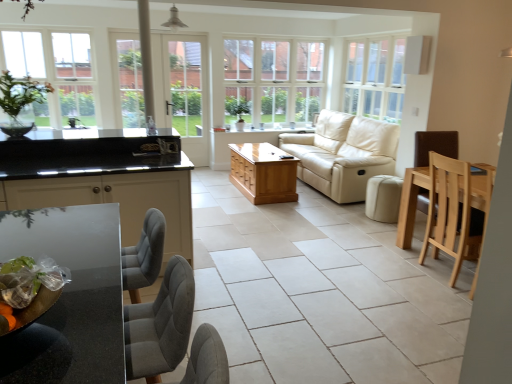
Question: Is the surface of clear glass window at upper left, the first window viewed from the left, in direct contact with green glass vase at upper left?

Choices:
 (A) yes
 (B) no

Answer: (B)

Question: Is clear glass window at upper left, the third window from the right, closer to the viewer compared to green glass vase at upper left?

Choices:
 (A) no
 (B) yes

Answer: (A)

Question: From the image's perspective, is clear glass window at upper left, the third window from the right, above green glass vase at upper left?

Choices:
 (A) yes
 (B) no

Answer: (A)

Question: From a real-world perspective, is clear glass window at upper left, the first window viewed from the left, over green glass vase at upper left?

Choices:
 (A) yes
 (B) no

Answer: (A)

Question: Can you confirm if clear glass window at upper left, the first window viewed from the left, is taller than green glass vase at upper left?

Choices:
 (A) no
 (B) yes

Answer: (B)

Question: Is light brown wooden coffee table at center wider or thinner than green glass vase at upper left?

Choices:
 (A) thin
 (B) wide

Answer: (B)

Question: From a real-world perspective, relative to green glass vase at upper left, is light brown wooden coffee table at center vertically above or below?

Choices:
 (A) below
 (B) above

Answer: (A)

Question: From the image's perspective, relative to green glass vase at upper left, is light brown wooden coffee table at center above or below?

Choices:
 (A) below
 (B) above

Answer: (A)

Question: Based on their positions, is light brown wooden coffee table at center located to the left or right of green glass vase at upper left?

Choices:
 (A) left
 (B) right

Answer: (B)

Question: Considering the positions of beige leather ottoman at center and natural wood chair at right in the image, is beige leather ottoman at center bigger or smaller than natural wood chair at right?

Choices:
 (A) small
 (B) big

Answer: (A)

Question: Relative to natural wood chair at right, is beige leather ottoman at center in front or behind?

Choices:
 (A) behind
 (B) front

Answer: (A)

Question: Considering the positions of beige leather ottoman at center and natural wood chair at right in the image, is beige leather ottoman at center wider or thinner than natural wood chair at right?

Choices:
 (A) thin
 (B) wide

Answer: (A)

Question: Is point (379, 221) closer or farther from the camera than point (454, 165)?

Choices:
 (A) farther
 (B) closer

Answer: (A)

Question: Is white glass screen door at center taller or shorter than beige leather couch at center?

Choices:
 (A) tall
 (B) short

Answer: (A)

Question: Is white glass screen door at center bigger or smaller than beige leather couch at center?

Choices:
 (A) big
 (B) small

Answer: (B)